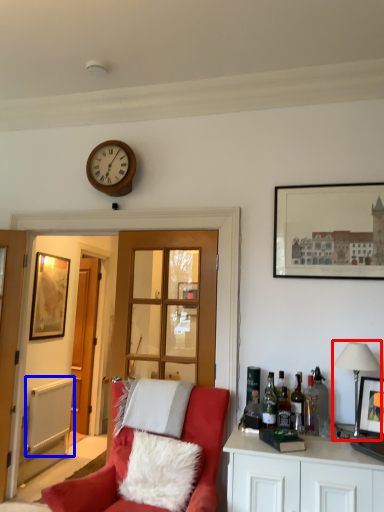
Question: Which object appears closest to the camera in this image, lamp (highlighted by a red box) or radiator (highlighted by a blue box)?

Choices:
 (A) lamp
 (B) radiator

Answer: (A)